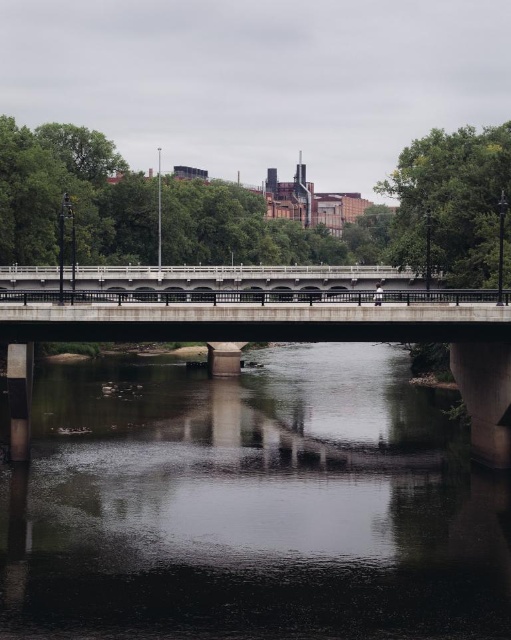
You are standing on the concrete bridge and looking down at the river. There is a point marked at coordinates (x=251, y=506). What does this point represent?

The point at coordinates (x=251, y=506) corresponds to the dark gray concrete river at center.